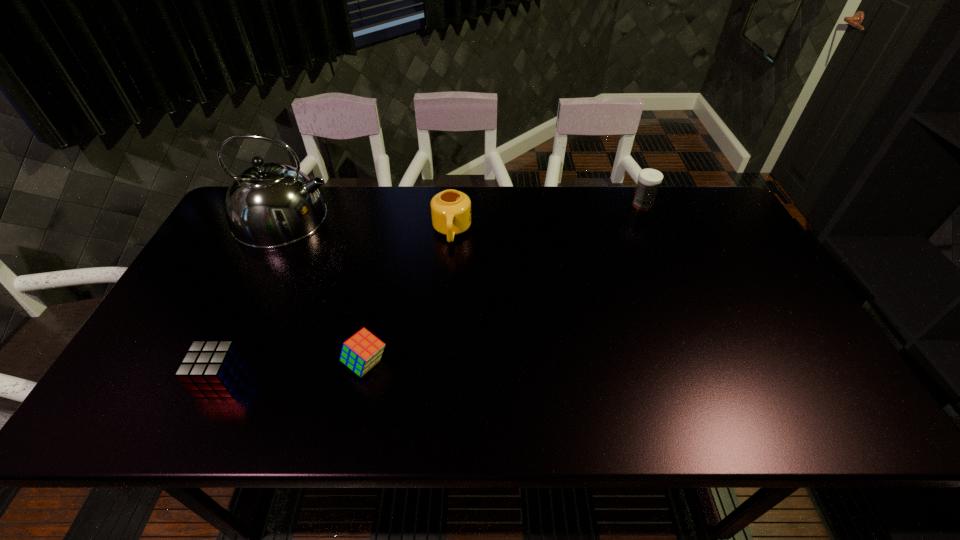
Where is `kettle at the far edge`? This screenshot has width=960, height=540. kettle at the far edge is located at coordinates (269, 205).

You are a GUI agent. You are given a task and a screenshot of the screen. Output one action in this format:
    pyautogui.click(x=<x>, y=<y>)
    Task: Click on the mug situated at the far edge
    
    Given the screenshot: What is the action you would take?
    pyautogui.click(x=451, y=210)

Identify the location of medicine positioned at the far edge. Image resolution: width=960 pixels, height=540 pixels. (649, 179).

Locate an element on the screen. object at the near edge is located at coordinates (210, 368).

The width and height of the screenshot is (960, 540). In order to click on object situated at the left edge in this screenshot , I will do `click(269, 205)`.

In order to click on object that is positioned at the far left corner in this screenshot , I will do `click(269, 205)`.

Where is `vacant region at the far edge of the desktop`? The image size is (960, 540). vacant region at the far edge of the desktop is located at coordinates (432, 187).

Locate an element on the screen. The height and width of the screenshot is (540, 960). vacant space at the near edge of the desktop is located at coordinates (438, 430).

I want to click on free space at the left edge, so click(x=230, y=292).

This screenshot has height=540, width=960. Find the location of `blank space at the right edge`. blank space at the right edge is located at coordinates (745, 315).